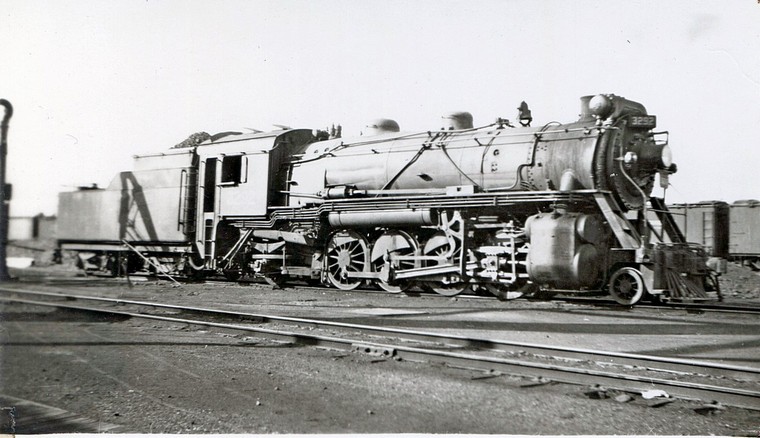
Locate an element on the screen. This screenshot has height=438, width=760. window is located at coordinates (232, 169).